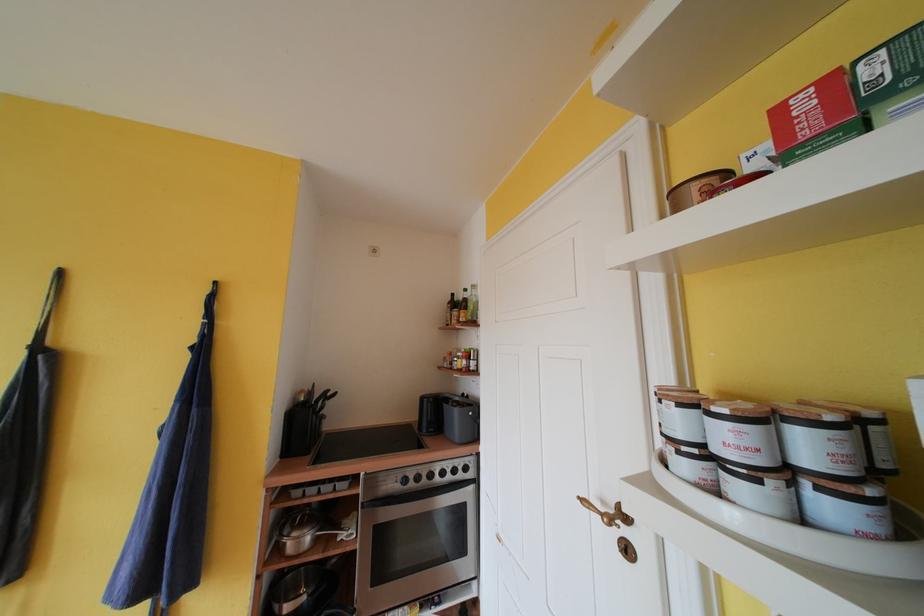
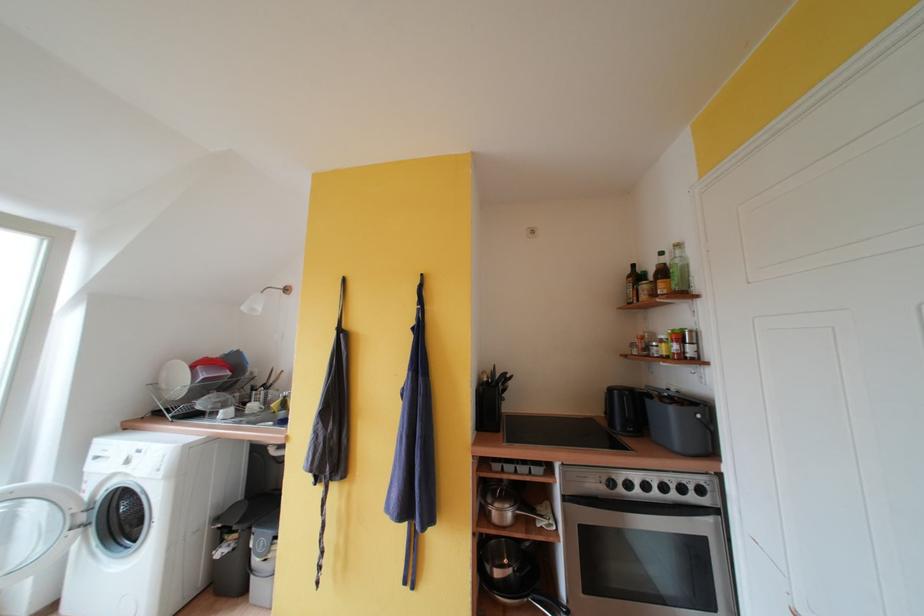
Find the pixel in the second image that matches [455,307] in the first image.

(634, 281)